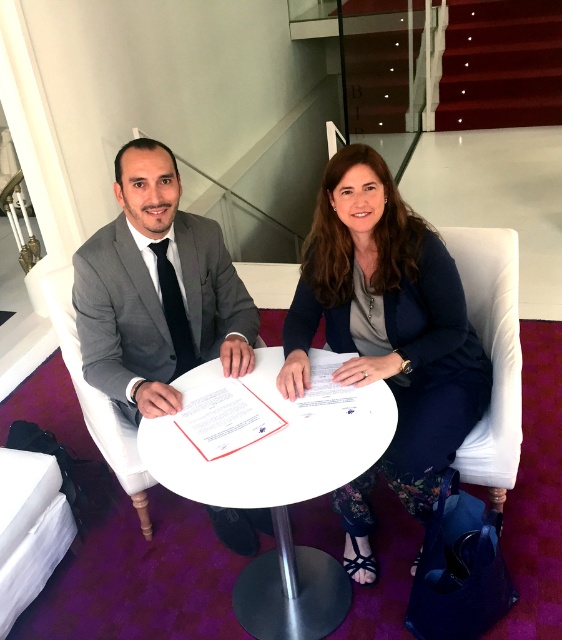
Between gray suit at center and white glossy table at center, which one is positioned lower?

white glossy table at center is below.

Between gray suit at center and white glossy table at center, which one is positioned higher?

gray suit at center is above.

Where is `gray suit at center`? This screenshot has height=640, width=562. gray suit at center is located at coordinates (156, 291).

Find the location of a particular element. Image resolution: width=562 pixels, height=640 pixels. gray suit at center is located at coordinates (156, 291).

Can you confirm if matte navy blazer at center is positioned below matte gray suit at center?

Indeed, matte navy blazer at center is positioned under matte gray suit at center.

Who is shorter, matte navy blazer at center or matte gray suit at center?

matte gray suit at center is shorter.

Does point (362, 529) come behind point (179, 227)?

Yes, it is behind point (179, 227).

Locate an element on the screen. This screenshot has height=640, width=562. matte navy blazer at center is located at coordinates (387, 336).

Who is more forward, (256, 627) or (219, 259)?

Point (256, 627)

Who is shorter, white glossy table at center or matte gray suit at center?

With less height is white glossy table at center.

I want to click on white glossy table at center, so click(278, 493).